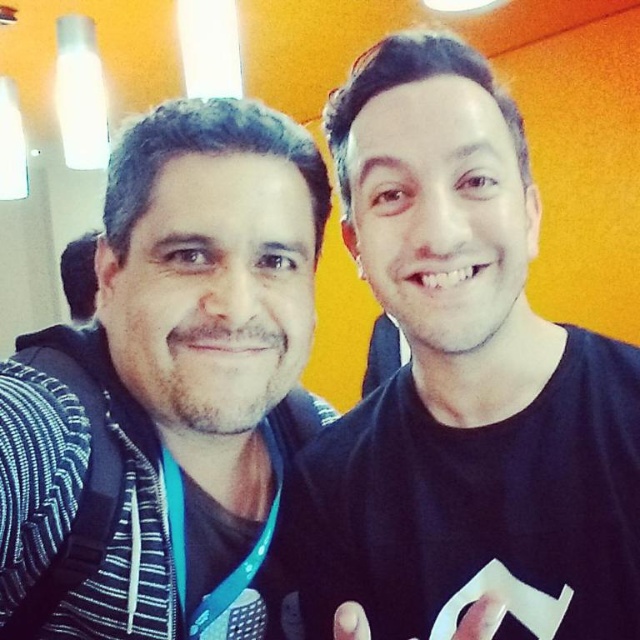
Question: Which of the following is the farthest from the observer?

Choices:
 (A) black striped hoodie at left
 (B) black matte t-shirt at right

Answer: (A)

Question: Which object appears closest to the camera in this image?

Choices:
 (A) black striped hoodie at left
 (B) black matte t-shirt at right

Answer: (B)

Question: Is black matte t-shirt at right behind black striped hoodie at left?

Choices:
 (A) no
 (B) yes

Answer: (A)

Question: Is black matte t-shirt at right positioned before black striped hoodie at left?

Choices:
 (A) no
 (B) yes

Answer: (B)

Question: Among these objects, which one is farthest from the camera?

Choices:
 (A) black striped hoodie at left
 (B) black matte t-shirt at right

Answer: (A)

Question: Is black matte t-shirt at right closer to camera compared to black striped hoodie at left?

Choices:
 (A) yes
 (B) no

Answer: (A)